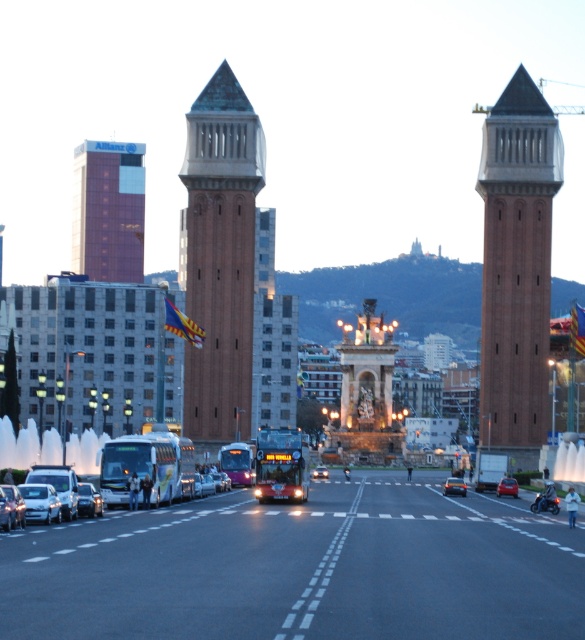
You are a pedestrian standing at the crosswalk near the brown brick bell tower at right and the shiny silver bus at center. Which object is located to your right?

The brown brick bell tower at right is positioned on the right side of the shiny silver bus at center, so from the crosswalk, the brown brick bell tower at right would be to your right.

You are a pedestrian standing at the crosswalk near the ornate monument. You need to cross the road but want to avoid vehicles that are taller than 2 meters. Based on the scene, can you safely walk past the metallic purple bus at center and the metallic silver car at lower left?

The metallic purple bus at center is much taller than the metallic silver car at lower left. Since the bus is over 2 meters tall, you should avoid it. However, the car is under 2 meters tall, so it is safe to walk past the metallic silver car at lower left.